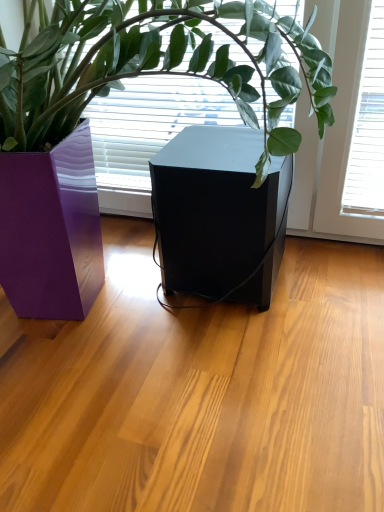
At what (x,y) coordinates should I click in order to perform the action: click on free spot to the left of black matte speaker at center. Please return your answer as a coordinate pair (x, y). Image resolution: width=384 pixels, height=512 pixels. Looking at the image, I should click on (120, 282).